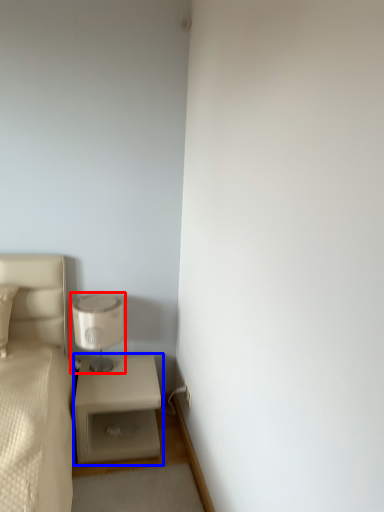
Question: Among these objects, which one is farthest to the camera, table lamp (highlighted by a red box) or nightstand (highlighted by a blue box)?

Choices:
 (A) table lamp
 (B) nightstand

Answer: (A)